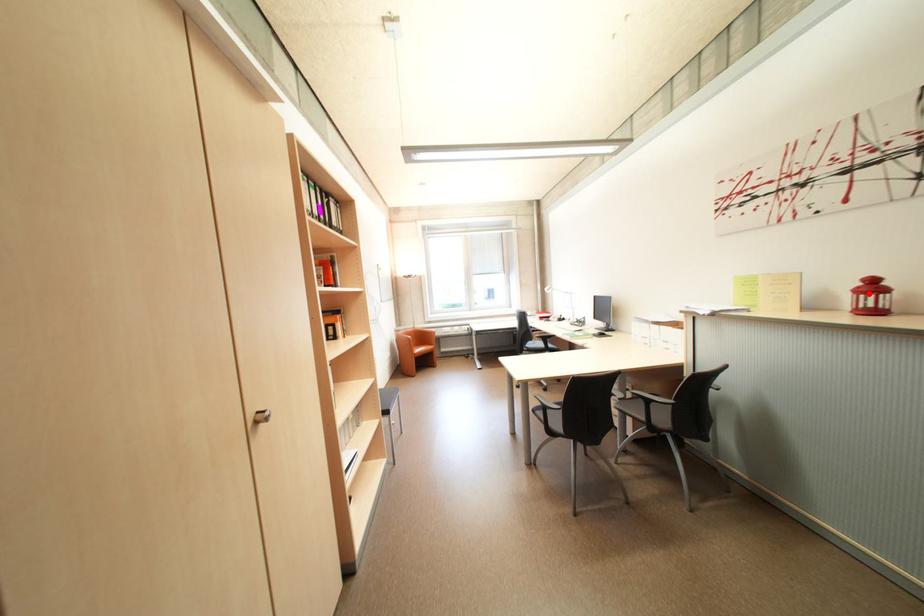
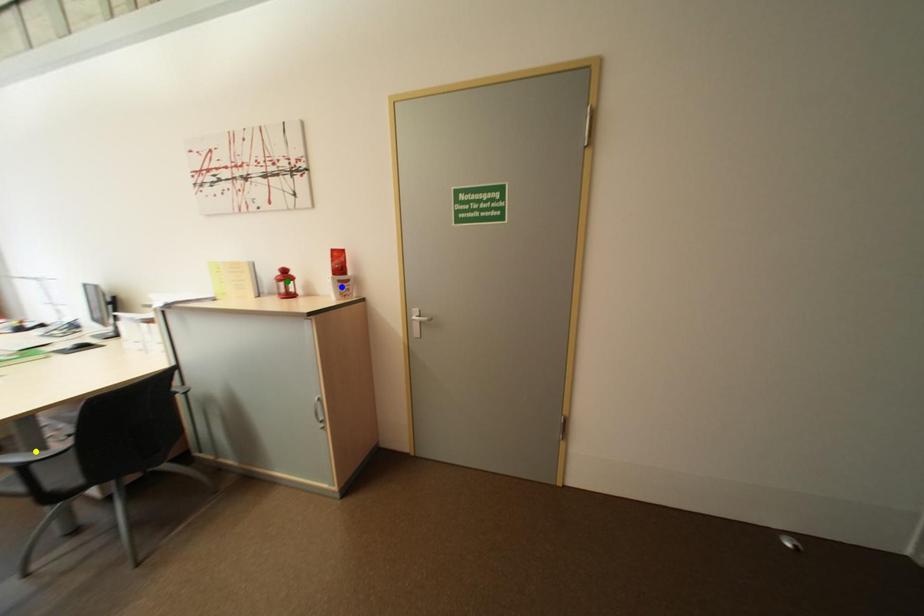
Question: I am providing you with two images of the same scene from different viewpoints. A red point is marked on the first image. You are given multiple points on the second image. Can you choose the point in image 2 that corresponds to the point in image 1?

Choices:
 (A) blue point
 (B) green point
 (C) yellow point

Answer: (B)